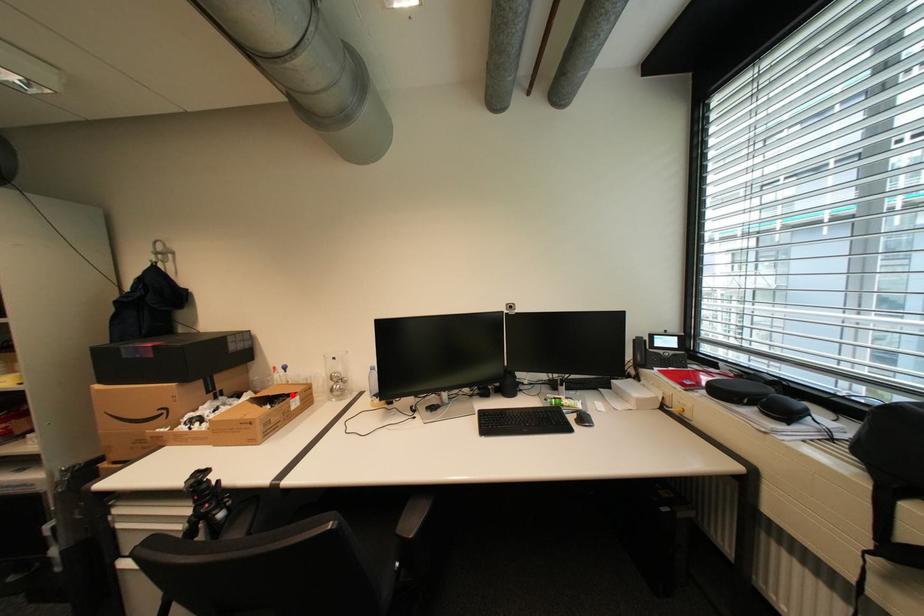
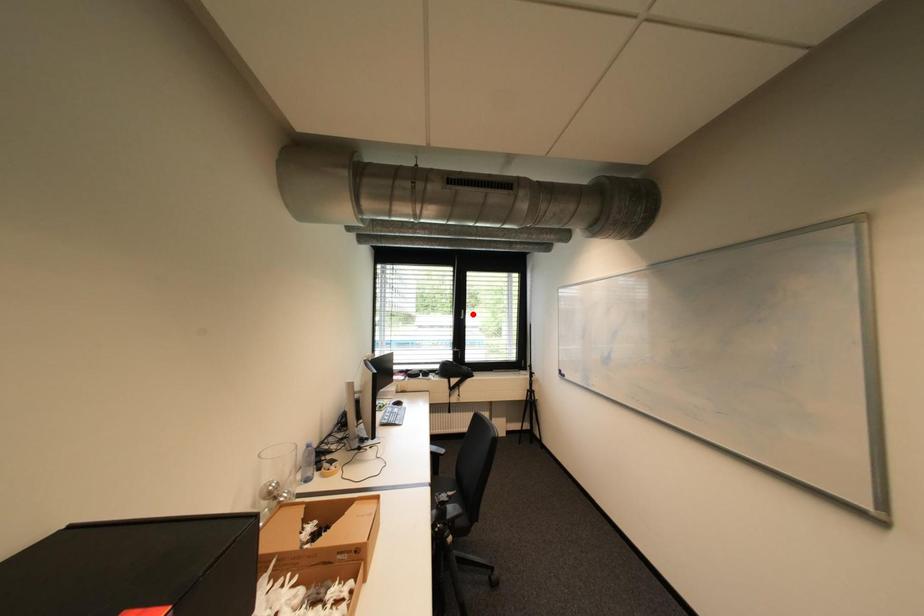
I am providing you with two images of the same scene from different viewpoints. A red point is marked on the first image and another point is marked on the second image. Is the red point in image1 aligned with the point shown in image2?

No